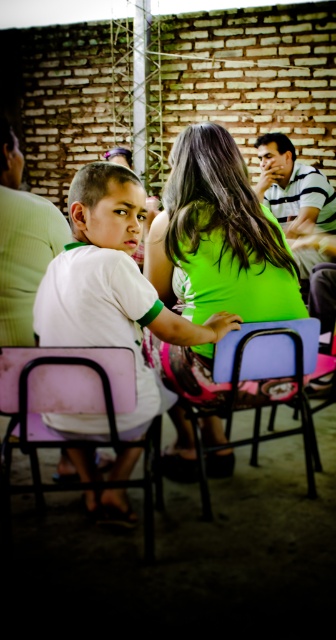
Is white matte shirt at center in front of pink matte chair at lower left?

No, it is behind pink matte chair at lower left.

Is the position of white matte shirt at center more distant than that of pink matte chair at lower left?

Yes.

Is point (151, 301) positioned in front of point (145, 452)?

Yes, point (151, 301) is closer to viewer.

Where is `white matte shirt at center`? white matte shirt at center is located at coordinates (112, 285).

Does blue plastic chair at center have a lesser width compared to matte green shirt at center?

In fact, blue plastic chair at center might be wider than matte green shirt at center.

Is point (203, 481) positioned before point (0, 216)?

Yes, it is.

Describe the element at coordinates (257, 385) in the screenshot. I see `blue plastic chair at center` at that location.

Locate an element on the screen. The image size is (336, 640). blue plastic chair at center is located at coordinates (257, 385).

Can you confirm if green matte shirt at center is bigger than matte green shirt at center?

Yes.

Can you confirm if green matte shirt at center is taller than matte green shirt at center?

Yes.

Is point (249, 209) more distant than point (61, 243)?

No, (249, 209) is in front of (61, 243).

The width and height of the screenshot is (336, 640). What are the coordinates of `green matte shirt at center` in the screenshot? It's located at (220, 236).